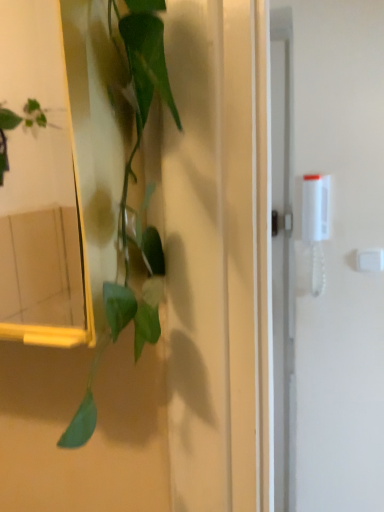
Question: From a real-world perspective, is green matte plant at left above or below white plastic light switch at upper right?

Choices:
 (A) below
 (B) above

Answer: (B)

Question: Is green matte plant at left wider or thinner than white plastic light switch at upper right?

Choices:
 (A) thin
 (B) wide

Answer: (B)

Question: From their relative heights in the image, would you say green matte plant at left is taller or shorter than white plastic light switch at upper right?

Choices:
 (A) tall
 (B) short

Answer: (A)

Question: Considering the positions of white plastic light switch at upper right and green matte plant at left in the image, is white plastic light switch at upper right wider or thinner than green matte plant at left?

Choices:
 (A) thin
 (B) wide

Answer: (A)

Question: From a real-world perspective, is white plastic light switch at upper right above or below green matte plant at left?

Choices:
 (A) above
 (B) below

Answer: (B)

Question: Based on their sizes in the image, would you say white plastic light switch at upper right is bigger or smaller than green matte plant at left?

Choices:
 (A) big
 (B) small

Answer: (B)

Question: In the image, is white plastic light switch at upper right positioned in front of or behind green matte plant at left?

Choices:
 (A) front
 (B) behind

Answer: (B)